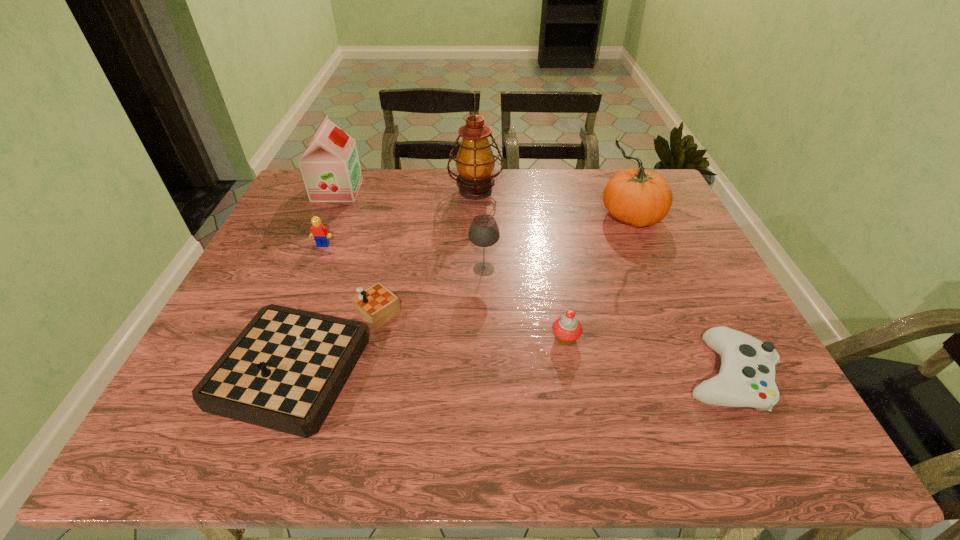
Find the location of a particular element. The width and height of the screenshot is (960, 540). oil lamp is located at coordinates (475, 161).

Locate an element on the screen. The image size is (960, 540). pumpkin is located at coordinates (637, 196).

Identify the location of soya milk. The image size is (960, 540). (330, 167).

The height and width of the screenshot is (540, 960). Identify the location of the fifth farthest object. (483, 232).

The height and width of the screenshot is (540, 960). Find the location of `the fifth shortest object`. the fifth shortest object is located at coordinates (483, 232).

At what (x,y) coordinates should I click in order to perform the action: click on the fifth nearest object. Please return your answer as a coordinate pair (x, y). Looking at the image, I should click on (319, 232).

In order to click on the sixth object from left to right in this screenshot , I will do `click(567, 329)`.

Locate an element on the screen. The height and width of the screenshot is (540, 960). chessboard is located at coordinates (284, 371).

Identify the location of the shortest object. The image size is (960, 540). (746, 378).

This screenshot has height=540, width=960. I want to click on vacant space situated on the front of the oil lamp, so click(x=474, y=275).